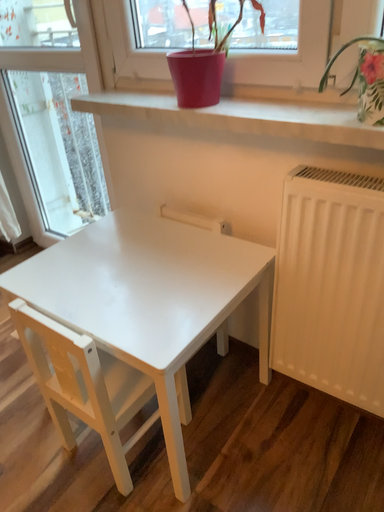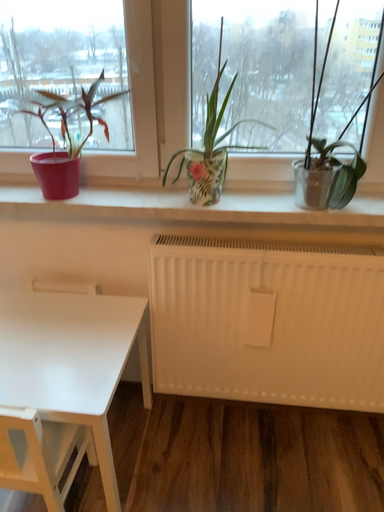
Question: Which way did the camera rotate in the video?

Choices:
 (A) rotated right
 (B) rotated left

Answer: (A)